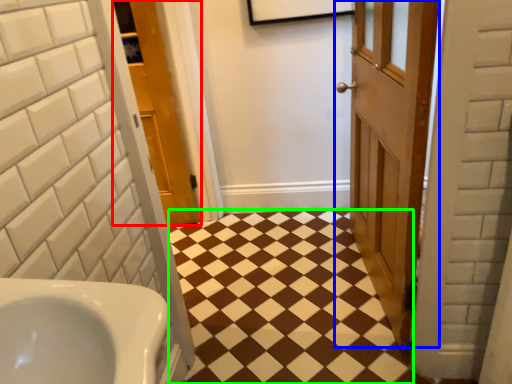
Question: Considering the real-world distances, which object is farthest from door (highlighted by a red box)? door (highlighted by a blue box) or square (highlighted by a green box)?

Choices:
 (A) door
 (B) square

Answer: (A)